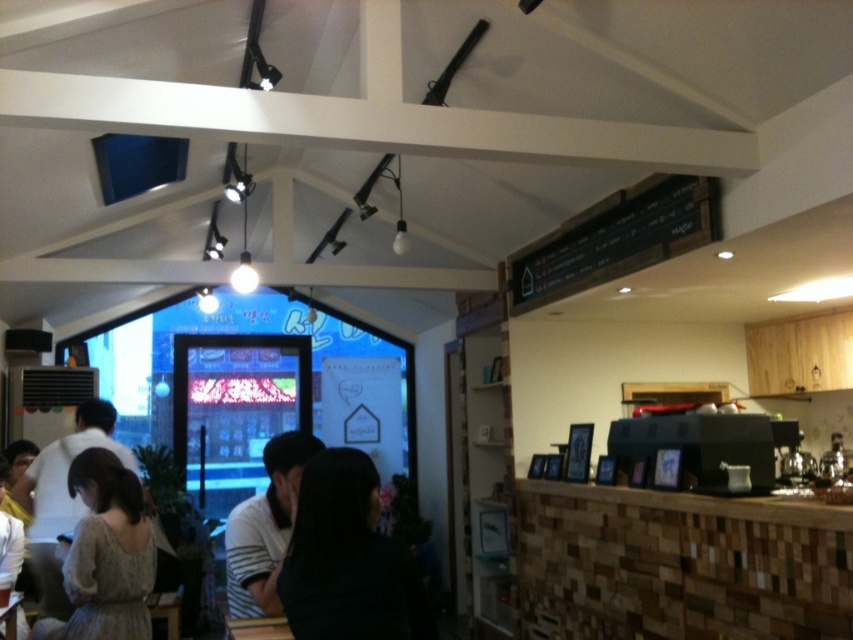
Is the position of dark hair at center more distant than that of knitted sweater at lower left?

No, it is not.

How much distance is there between dark hair at center and knitted sweater at lower left?

3.53 feet

The width and height of the screenshot is (853, 640). What are the coordinates of `dark hair at center` in the screenshot? It's located at (347, 560).

Is the position of dark hair at center less distant than that of white striped shirt at center?

Yes, it is.

Does dark hair at center come behind white striped shirt at center?

No, it is in front of white striped shirt at center.

What are the coordinates of `dark hair at center` in the screenshot? It's located at (347, 560).

Is knitted sweater at lower left positioned behind white striped shirt at center?

Yes, it is behind white striped shirt at center.

Is knitted sweater at lower left above white striped shirt at center?

No.

What do you see at coordinates (105, 554) in the screenshot?
I see `knitted sweater at lower left` at bounding box center [105, 554].

I want to click on knitted sweater at lower left, so click(105, 554).